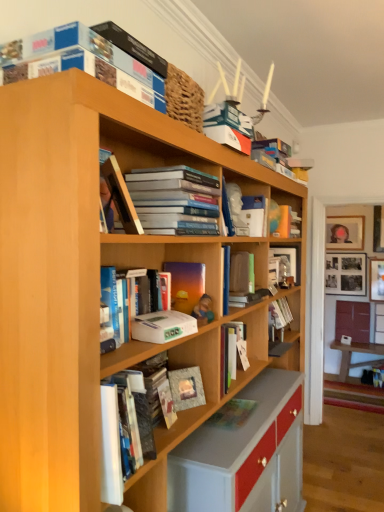
Question: Is hardcover book at center, the 8th book in the front-to-back sequence, in front of or behind matte gray paperback book at center, which appears as the first paperback book when ordered from the bottom, in the image?

Choices:
 (A) behind
 (B) front

Answer: (A)

Question: Is hardcover book at center, the second book viewed from the back, wider or thinner than matte gray paperback book at center, which appears as the first paperback book when ordered from the bottom?

Choices:
 (A) thin
 (B) wide

Answer: (B)

Question: Which of these objects is positioned farthest from the matte orange vase at center, which is counted as the 7th book, starting from the front?

Choices:
 (A) satin gold frame at center, which is the sixth book in back-to-front order
 (B) matte green book at center, arranged as the 5th book when viewed from the back
 (C) hardcover books at upper center, the 7th book viewed from the back
 (D) white matte paperback book at center, which is the 2th paperback book from back to front
 (E) wooden table at lower right

Answer: (E)

Question: Based on their relative distances, which object is farther from the matte green book at center, the fifth book positioned from the front?

Choices:
 (A) wooden table at lower right
 (B) wooden picture frame at upper right
 (C) satin gold frame at center, which appears as the fourth book when viewed from the front
 (D) matte blue book at upper center, the 6th book positioned from the front
 (E) blue cardboard box at upper center, which is counted as the 1th book, starting from the front

Answer: (A)